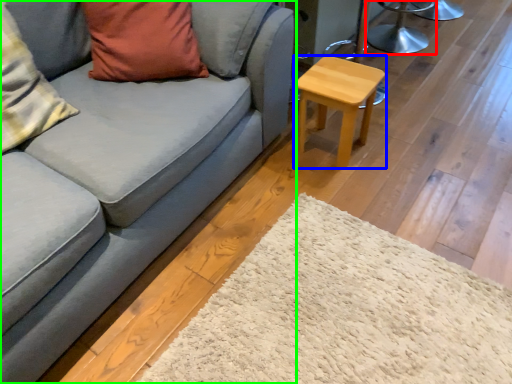
Question: Considering the real-world distances, which object is farthest from swivel chair (highlighted by a red box)? stool (highlighted by a blue box) or studio couch (highlighted by a green box)?

Choices:
 (A) stool
 (B) studio couch

Answer: (B)